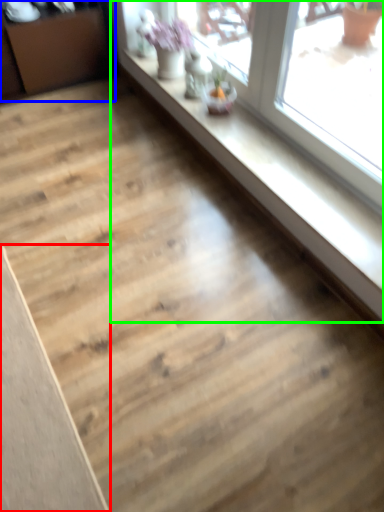
Question: Based on their relative distances, which object is farther from plank (highlighted by a red box)? Choose from dresser (highlighted by a blue box) and window (highlighted by a green box).

Choices:
 (A) dresser
 (B) window

Answer: (A)